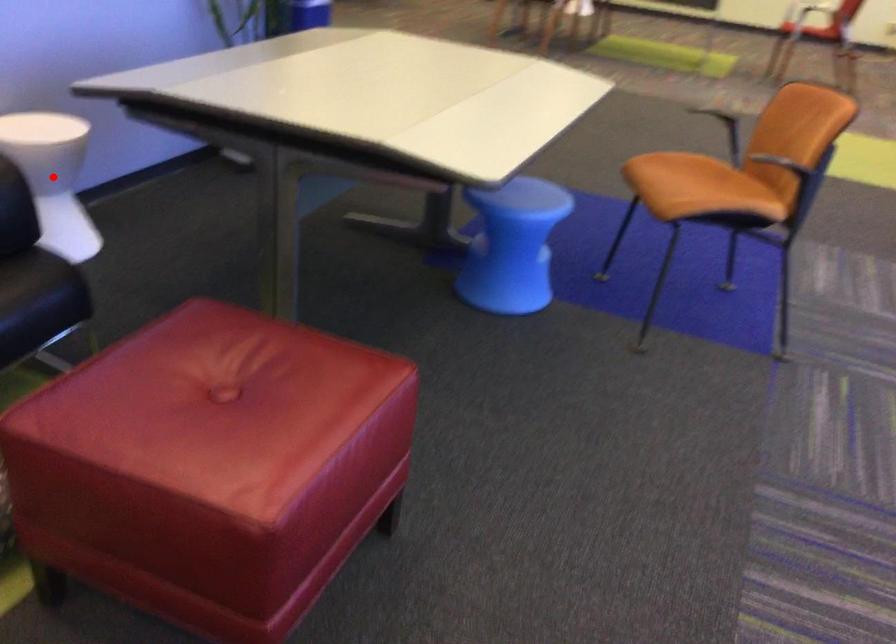
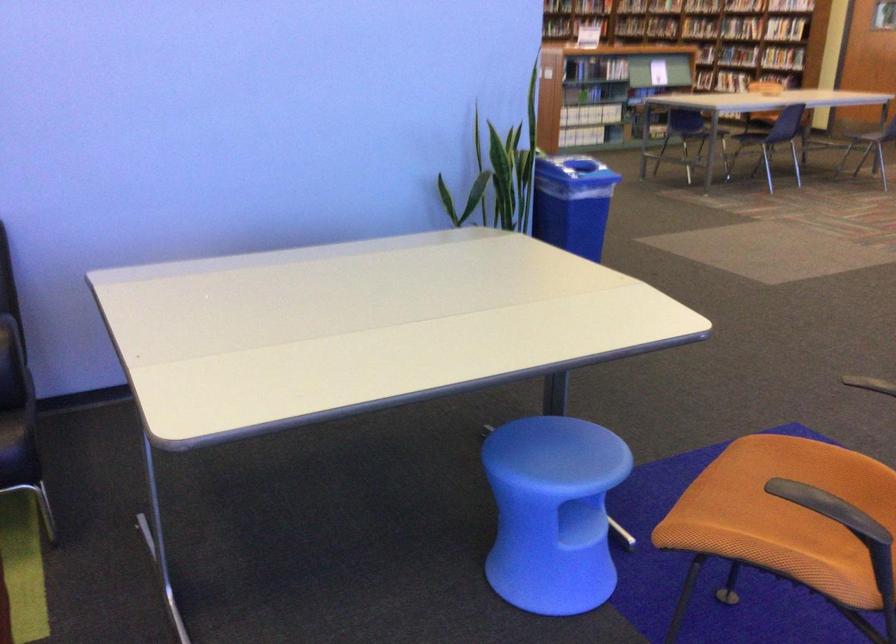
Question: I am providing you with two images of the same scene from different viewpoints. A red point is marked on the first image. At the location where the point appears in image 1, is it still visible in image 2?

Choices:
 (A) Yes
 (B) No

Answer: (B)